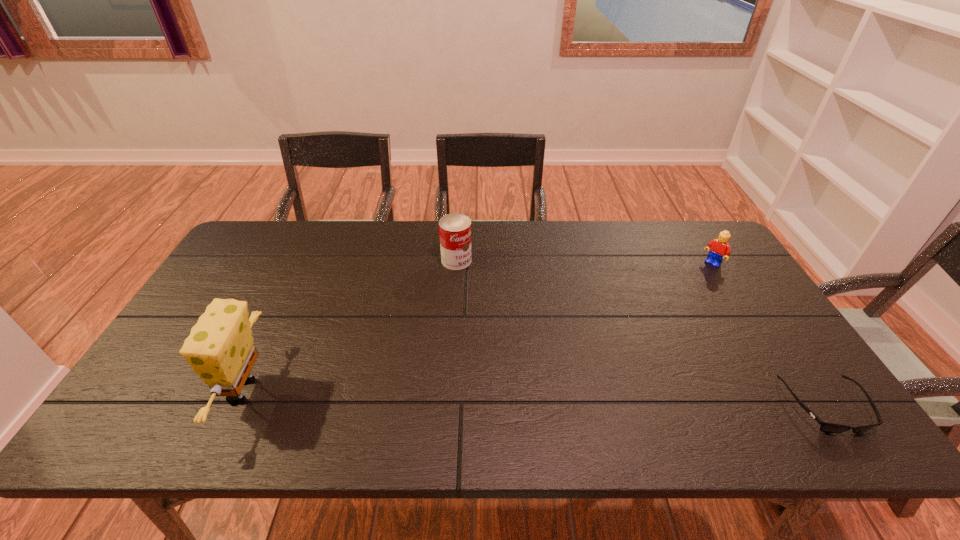
Find the location of a particular element. The height and width of the screenshot is (540, 960). the tallest object is located at coordinates (220, 348).

This screenshot has height=540, width=960. Find the location of `sponge`. sponge is located at coordinates (220, 348).

Identify the location of sunglasses. [x=825, y=427].

Find the location of `can`. can is located at coordinates (454, 229).

Where is `the third shortest object`? The image size is (960, 540). the third shortest object is located at coordinates (454, 229).

Image resolution: width=960 pixels, height=540 pixels. What are the coordinates of `Lego` in the screenshot? It's located at (719, 248).

At what (x,y) coordinates should I click in order to perform the action: click on blank space located 0.130m on the face of the tallest object. Please return your answer as a coordinate pair (x, y). This screenshot has height=540, width=960. Looking at the image, I should click on (167, 391).

The image size is (960, 540). In order to click on vacant region located on the face of the tallest object in this screenshot , I will do `click(187, 391)`.

At what (x,y) coordinates should I click in order to perform the action: click on free location located 0.150m on the face of the tallest object. Please return your answer as a coordinate pair (x, y). This screenshot has height=540, width=960. Looking at the image, I should click on (158, 391).

The width and height of the screenshot is (960, 540). I want to click on free space located on the front label of the second tallest object, so click(x=532, y=329).